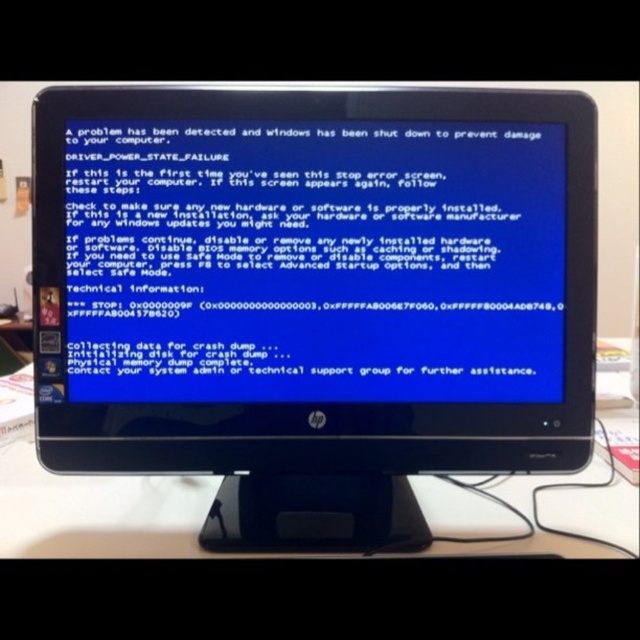
Question: Can you confirm if black plastic monitor at center is positioned to the left of white plastic table at lower center?

Choices:
 (A) no
 (B) yes

Answer: (B)

Question: Is black plastic monitor at center positioned behind white plastic table at lower center?

Choices:
 (A) yes
 (B) no

Answer: (A)

Question: Which point appears closest to the camera in this image?

Choices:
 (A) (618, 515)
 (B) (51, 216)

Answer: (B)

Question: Among these points, which one is farthest from the camera?

Choices:
 (A) (544, 509)
 (B) (40, 152)

Answer: (A)

Question: In this image, where is black plastic monitor at center located relative to white plastic table at lower center?

Choices:
 (A) above
 (B) below

Answer: (A)